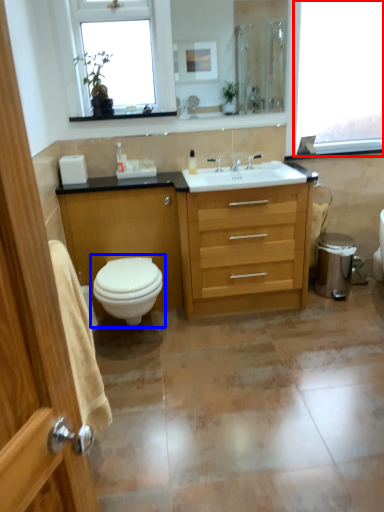
Question: Which point is closer to the camera, window (highlighted by a red box) or toilet (highlighted by a blue box)?

Choices:
 (A) window
 (B) toilet

Answer: (B)